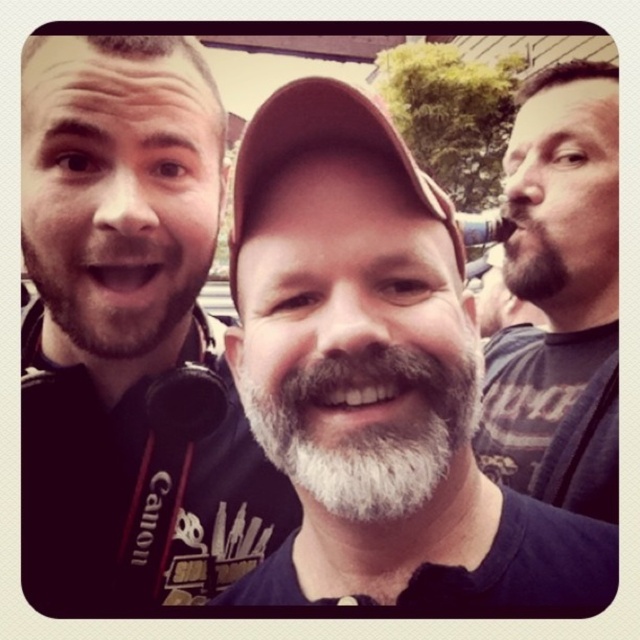
You are a photographer at the event and need to capture a clear shot of the white matte beard at center and the brown fabric cap at center. Which object should you focus on first to ensure both are in focus?

You should focus on the white matte beard at center first since it is in front of the brown fabric cap at center, ensuring both will be in focus when starting with the closer object.